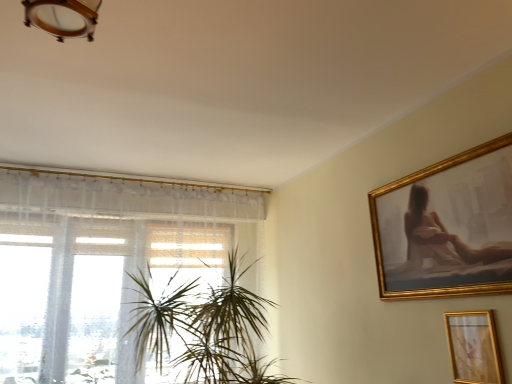
Find the location of `gold metallic picture frame at lower right`. gold metallic picture frame at lower right is located at coordinates (473, 347).

At what (x,y) coordinates should I click in order to perform the action: click on houseplant below the gold metallic picture frame at lower right (from the image's perspective). Please return your answer as a coordinate pair (x, y). This screenshot has height=384, width=512. Looking at the image, I should click on (205, 328).

From the image's perspective, is green leafy plant at center on gold metallic picture frame at lower right?

No.

Would you consider green leafy plant at center to be distant from gold metallic picture frame at lower right?

Yes, green leafy plant at center is far from gold metallic picture frame at lower right.

Looking at this image, from a real-world perspective, is gold metallic picture frame at lower right physically below green leafy plant at center?

Yes, from a real-world perspective, gold metallic picture frame at lower right is below green leafy plant at center.

Image resolution: width=512 pixels, height=384 pixels. What are the coordinates of `picture frame below the green leafy plant at center (from a real-world perspective)` in the screenshot? It's located at (473, 347).

Considering the positions of objects gold metallic picture frame at lower right and green leafy plant at center in the image provided, who is more to the left, gold metallic picture frame at lower right or green leafy plant at center?

From the viewer's perspective, green leafy plant at center appears more on the left side.

Can green leafy plant at center be found inside gold metallic picture frame at lower right?

Definitely not — green leafy plant at center is not inside gold metallic picture frame at lower right.

Which is more to the left, gold metallic picture frame at lower right or white sheer curtain at left?

From the viewer's perspective, white sheer curtain at left appears more on the left side.

From a real-world perspective, is gold metallic picture frame at lower right above or below white sheer curtain at left?

Clearly, from a real-world perspective, gold metallic picture frame at lower right is below white sheer curtain at left.

Is gold metallic picture frame at lower right completely or partially outside of white sheer curtain at left?

Yes.

Is the surface of gold metallic picture frame at lower right in direct contact with white sheer curtain at left?

No, gold metallic picture frame at lower right is not beside white sheer curtain at left.

In the scene shown: Is white sheer curtain at left taller or shorter than gold metallic picture frame at lower right?

white sheer curtain at left is taller than gold metallic picture frame at lower right.

Which object is further away from the camera taking this photo, white sheer curtain at left or gold metallic picture frame at lower right?

white sheer curtain at left is further from the camera.

Based on their sizes in the image, would you say white sheer curtain at left is bigger or smaller than gold metallic picture frame at lower right?

Considering their sizes, white sheer curtain at left takes up more space than gold metallic picture frame at lower right.

From a real-world perspective, is white sheer curtain at left over green leafy plant at center?

Correct, in the physical world, white sheer curtain at left is higher than green leafy plant at center.

Could you tell me if white sheer curtain at left is facing green leafy plant at center?

Yes.

Locate an element on the screen. This screenshot has width=512, height=384. window on the left of green leafy plant at center is located at coordinates (99, 265).

Based on the photo, can you confirm if white sheer curtain at left is wider than green leafy plant at center?

No.

Considering the positions of points (192, 291) and (209, 265), is point (192, 291) farther from camera compared to point (209, 265)?

No.

From the image's perspective, is green leafy plant at center on white sheer curtain at left?

No, from the image's perspective, green leafy plant at center is not over white sheer curtain at left.

From the picture: Between green leafy plant at center and white sheer curtain at left, which one appears on the right side from the viewer's perspective?

green leafy plant at center is more to the right.

Can white sheer curtain at left be found inside green leafy plant at center?

No.

Find the location of `picture frame below the green leafy plant at center (from a real-world perspective)`. picture frame below the green leafy plant at center (from a real-world perspective) is located at coordinates (473, 347).

This screenshot has height=384, width=512. Find the location of `picture frame above the green leafy plant at center (from the image's perspective)`. picture frame above the green leafy plant at center (from the image's perspective) is located at coordinates (473, 347).

Which object lies nearer to the anchor point white sheer curtain at left, gold metallic picture frame at lower right or green leafy plant at center?

Among the two, green leafy plant at center is located nearer to white sheer curtain at left.

Considering their positions, is white sheer curtain at left positioned closer to gold metallic picture frame at lower right than green leafy plant at center?

green leafy plant at center is positioned closer to the anchor gold metallic picture frame at lower right.

From the image, which object appears to be nearer to gold metallic picture frame at lower right, green leafy plant at center or white sheer curtain at left?

green leafy plant at center is closer to gold metallic picture frame at lower right.

Looking at the image, which one is located closer to green leafy plant at center, white sheer curtain at left or gold metallic picture frame at lower right?

The object closer to green leafy plant at center is white sheer curtain at left.

Considering their positions, is gold metallic picture frame at lower right positioned closer to green leafy plant at center than white sheer curtain at left?

white sheer curtain at left is closer to green leafy plant at center.

From the image, which object appears to be nearer to white sheer curtain at left, green leafy plant at center or gold metallic picture frame at lower right?

Among the two, green leafy plant at center is located nearer to white sheer curtain at left.

Find the location of a particular element. The image size is (512, 384). houseplant situated between white sheer curtain at left and gold metallic picture frame at lower right from left to right is located at coordinates (205, 328).